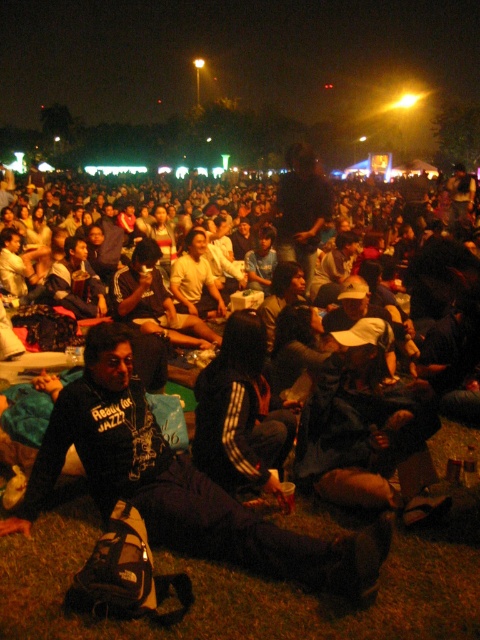
Question: Does black fabric crowd at lower left come in front of black fleece jacket at center?

Choices:
 (A) no
 (B) yes

Answer: (A)

Question: Can you confirm if black matte jacket at lower left is bigger than black fleece jacket at center?

Choices:
 (A) yes
 (B) no

Answer: (A)

Question: Which of the following is the closest to the observer?

Choices:
 (A) black fleece jacket at center
 (B) black fabric crowd at lower left
 (C) black matte jacket at lower left

Answer: (C)

Question: Is black fabric crowd at lower left positioned at the back of black fleece jacket at center?

Choices:
 (A) no
 (B) yes

Answer: (B)

Question: Which point is farther to the camera?

Choices:
 (A) black fleece jacket at center
 (B) black matte jacket at lower left
 (C) black fabric crowd at lower left

Answer: (C)

Question: Among these objects, which one is farthest from the camera?

Choices:
 (A) black matte jacket at lower left
 (B) black fabric crowd at lower left

Answer: (B)